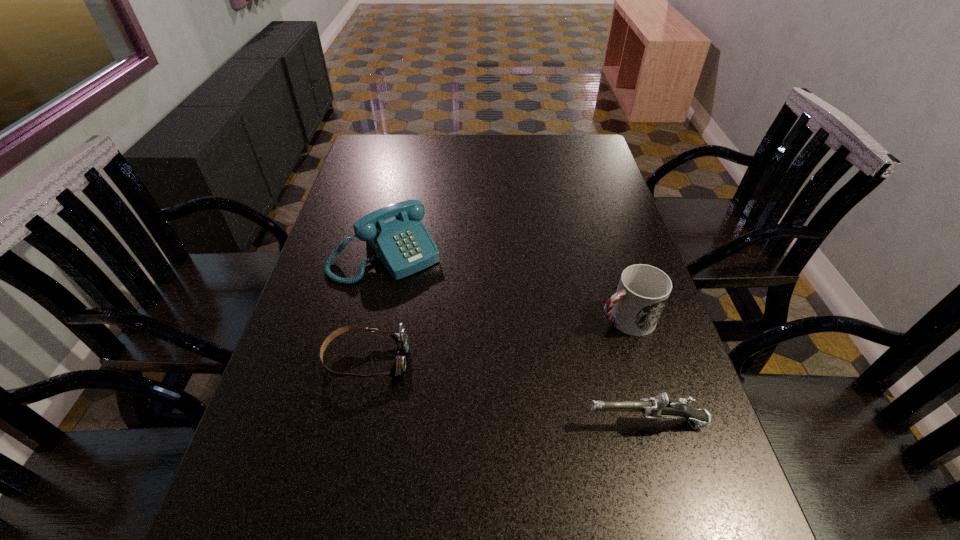
At what (x,y) coordinates should I click in order to perform the action: click on vacant position located on the handle side of the cup. Please return your answer as a coordinate pair (x, y). The image size is (960, 540). Looking at the image, I should click on (578, 335).

Image resolution: width=960 pixels, height=540 pixels. Identify the location of vacant area situated 0.310m on the handle side of the cup. (483, 375).

At what (x,y) coordinates should I click in order to perform the action: click on vacant region located on the dial of the farthest object. Please return your answer as a coordinate pair (x, y). Image resolution: width=960 pixels, height=540 pixels. Looking at the image, I should click on (429, 300).

Image resolution: width=960 pixels, height=540 pixels. In order to click on free spot located 0.120m on the dial of the farthest object in this screenshot , I will do (435, 308).

Where is `free space located 0.370m on the dial of the farthest object`? free space located 0.370m on the dial of the farthest object is located at coordinates (493, 380).

Find the location of `goggles that is at the left edge`. goggles that is at the left edge is located at coordinates (401, 339).

Where is `telephone present at the left edge`? telephone present at the left edge is located at coordinates (402, 243).

Find the location of `gun that is at the right edge`. gun that is at the right edge is located at coordinates (655, 407).

Identify the location of cup that is at the right edge. (643, 290).

Identify the location of vacant area at the far edge. Image resolution: width=960 pixels, height=540 pixels. (468, 158).